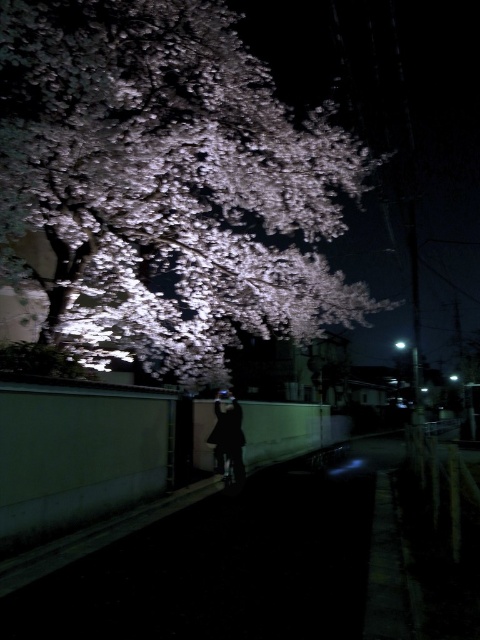
You are standing at the point marked by the coordinates point (167, 182) in the image. What object is exactly at your current location?

The white blossoms at upper left are located at point (167, 182), so the object exactly at your current location is the white blossoms at upper left.

You are standing at the center of the image and want to take a photo of the white blossoms at upper left. In which direction should you move to get a better view of them?

The white blossoms at upper left are located at point (x=167, y=182), so you should move towards the upper left direction to get a better view of them.

You are a photographer standing in front of the large tree with blossoms. You notice the white blossoms at upper left and the black matte coat at center. Which object is located to the right of the other?

The white blossoms at upper left is positioned on the right side of black matte coat at center.